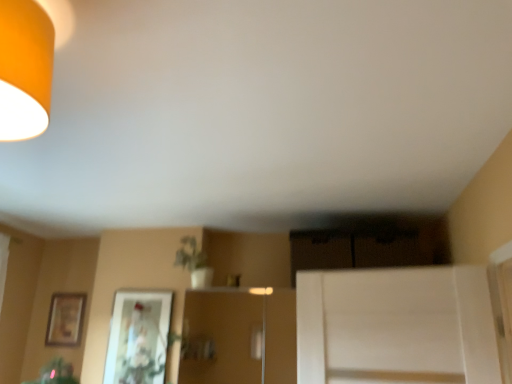
Question: Is green matte plant at center next to wooden framed picture at left, which ranks as the 1th picture frame in left-to-right order?

Choices:
 (A) no
 (B) yes

Answer: (A)

Question: Can you confirm if green matte plant at center is positioned to the left of wooden framed picture at left, the second picture frame when ordered from right to left?

Choices:
 (A) yes
 (B) no

Answer: (B)

Question: Would you say green matte plant at center is a long distance from wooden framed picture at left, placed as the first picture frame when sorted from back to front?

Choices:
 (A) no
 (B) yes

Answer: (B)

Question: Considering the relative sizes of green matte plant at center and wooden framed picture at left, the second picture frame when ordered from right to left, in the image provided, is green matte plant at center bigger than wooden framed picture at left, the second picture frame when ordered from right to left,?

Choices:
 (A) yes
 (B) no

Answer: (A)

Question: From a real-world perspective, is green matte plant at center physically below wooden framed picture at left, placed as the first picture frame when sorted from back to front?

Choices:
 (A) yes
 (B) no

Answer: (B)

Question: Is green matte plant at center outside wooden framed picture at left, the second picture frame when ordered from right to left?

Choices:
 (A) no
 (B) yes

Answer: (B)

Question: Can we say wooden framed picture at left, marked as the 2th picture frame in a front-to-back arrangement, lies outside matte glass picture frame at center, acting as the 1th picture frame starting from the right?

Choices:
 (A) yes
 (B) no

Answer: (A)

Question: Is wooden framed picture at left, which ranks as the 1th picture frame in left-to-right order, next to matte glass picture frame at center, the 1th picture frame positioned from the front?

Choices:
 (A) yes
 (B) no

Answer: (B)

Question: Considering the relative sizes of wooden framed picture at left, the second picture frame when ordered from right to left, and matte glass picture frame at center, the 1th picture frame positioned from the front, in the image provided, is wooden framed picture at left, the second picture frame when ordered from right to left, wider than matte glass picture frame at center, the 1th picture frame positioned from the front,?

Choices:
 (A) yes
 (B) no

Answer: (B)

Question: Does wooden framed picture at left, the second picture frame when ordered from right to left, have a greater height compared to matte glass picture frame at center, which is the 2th picture frame in left-to-right order?

Choices:
 (A) no
 (B) yes

Answer: (A)

Question: From the image's perspective, is wooden framed picture at left, which ranks as the 1th picture frame in left-to-right order, below matte glass picture frame at center, positioned as the second picture frame in back-to-front order?

Choices:
 (A) yes
 (B) no

Answer: (B)

Question: Does wooden framed picture at left, the second picture frame when ordered from right to left, come in front of matte glass picture frame at center, the 1th picture frame positioned from the front?

Choices:
 (A) yes
 (B) no

Answer: (B)

Question: Can you confirm if green matte plant at center is bigger than matte glass picture frame at center, acting as the 1th picture frame starting from the right?

Choices:
 (A) no
 (B) yes

Answer: (B)